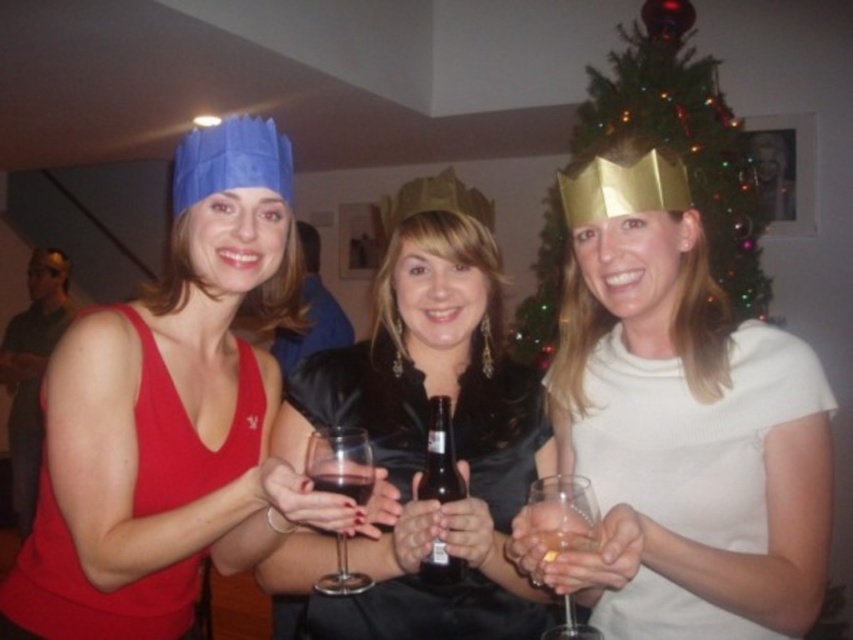
Does transparent glass at center have a larger size compared to translucent glass at center?

Correct, transparent glass at center is larger in size than translucent glass at center.

What do you see at coordinates (340, 461) in the screenshot?
I see `transparent glass at center` at bounding box center [340, 461].

The height and width of the screenshot is (640, 853). In order to click on transparent glass at center in this screenshot , I will do `click(340, 461)`.

Is transparent glass at center to the right of brown glass bottle at center from the viewer's perspective?

No, transparent glass at center is not to the right of brown glass bottle at center.

The width and height of the screenshot is (853, 640). In order to click on transparent glass at center in this screenshot , I will do `click(340, 461)`.

Describe the element at coordinates (340, 461) in the screenshot. I see `transparent glass at center` at that location.

Where is `transparent glass at center`? This screenshot has height=640, width=853. transparent glass at center is located at coordinates coord(340,461).

Can you confirm if matte blue paper crown at left is positioned to the right of green shiny christmas tree at upper center?

Incorrect, matte blue paper crown at left is not on the right side of green shiny christmas tree at upper center.

Which is more to the left, matte blue paper crown at left or green shiny christmas tree at upper center?

From the viewer's perspective, matte blue paper crown at left appears more on the left side.

The image size is (853, 640). I want to click on matte blue paper crown at left, so 172,413.